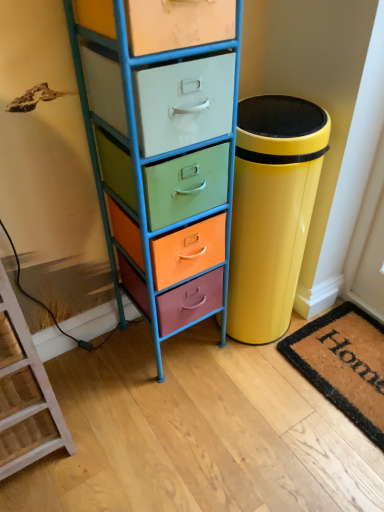
At what (x,y) coordinates should I click in order to perform the action: click on free space between wooden ladder at lower left and metallic multi-colored chest of drawers at left. Please return your answer as a coordinate pair (x, y). Looking at the image, I should click on (105, 385).